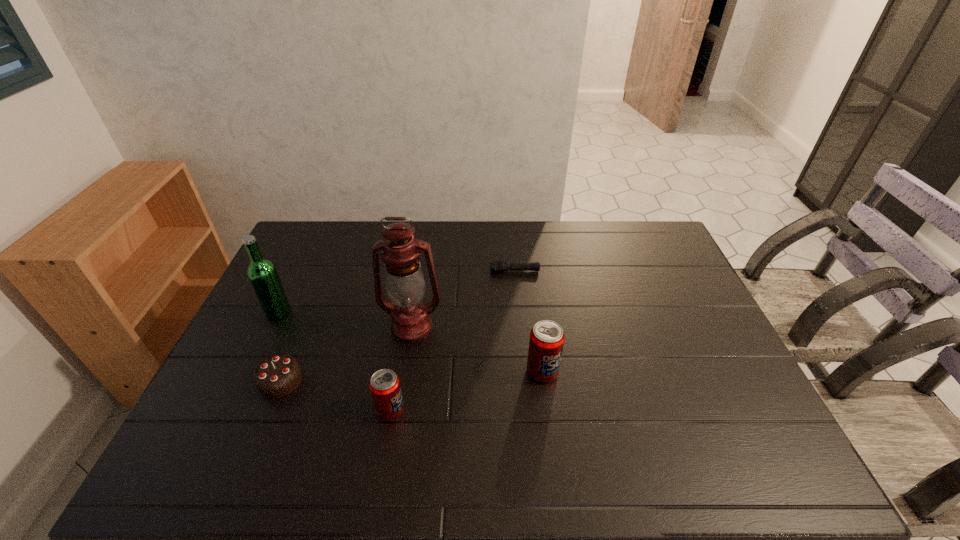
Image resolution: width=960 pixels, height=540 pixels. In order to click on vacant space at the far edge in this screenshot , I will do `click(350, 230)`.

Identify the location of free space at the left edge of the desktop. (236, 377).

In the image, there is a desktop. What are the coordinates of `vacant space at the right edge` in the screenshot? It's located at (671, 345).

I want to click on vacant point at the far left corner, so click(341, 225).

In the image, there is a desktop. Where is `vacant space at the near right corner`? The height and width of the screenshot is (540, 960). vacant space at the near right corner is located at coordinates (722, 414).

I want to click on unoccupied area between the taller soda can and the oil lamp, so click(x=477, y=349).

I want to click on free spot between the flashlight and the tallest object, so click(x=464, y=299).

The height and width of the screenshot is (540, 960). I want to click on vacant space that's between the third shortest object and the tallest object, so (401, 369).

Locate an element on the screen. free space between the oil lamp and the taller soda can is located at coordinates (477, 349).

Where is `empty space that is in between the farther soda can and the chocolate cake`? empty space that is in between the farther soda can and the chocolate cake is located at coordinates (412, 376).